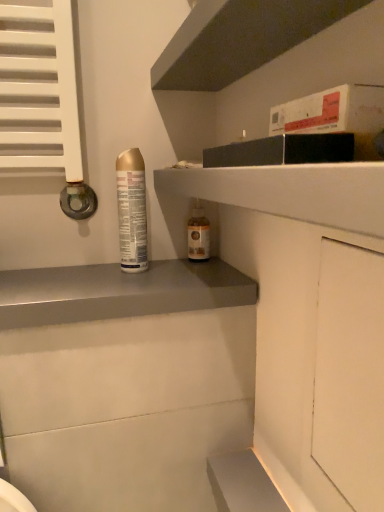
At what (x,y) coordinates should I click in order to perform the action: click on vacant region in front of translucent glass bottle at center, the 1th bottle when ordered from back to front. Please return your answer as a coordinate pair (x, y). This screenshot has height=512, width=384. Looking at the image, I should click on (184, 277).